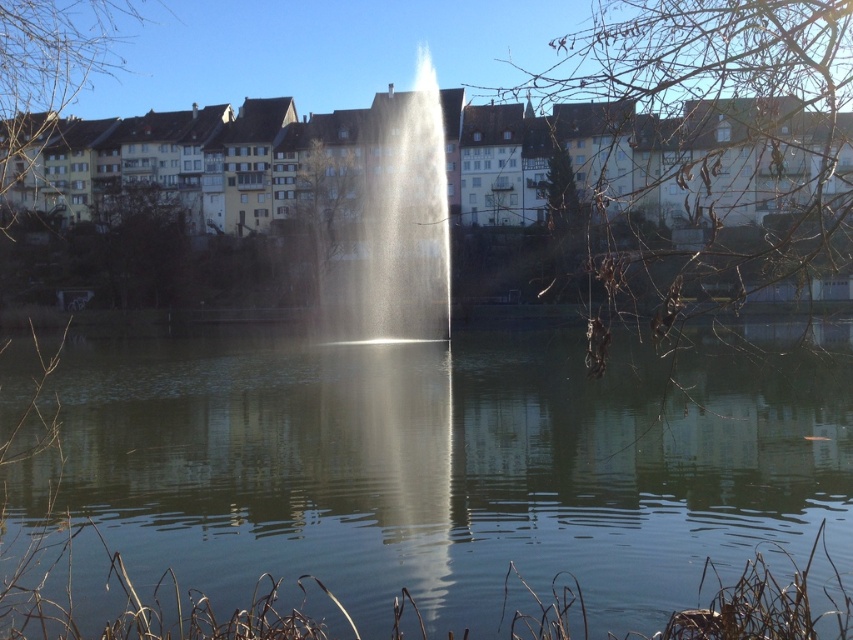
Which is in front, point (546, 477) or point (399, 144)?

Point (546, 477)

The image size is (853, 640). Describe the element at coordinates (451, 467) in the screenshot. I see `clear water at center` at that location.

Who is more forward, (426,440) or (409,268)?

Point (426,440)

You are a GUI agent. You are given a task and a screenshot of the screen. Output one action in this format:
    pyautogui.click(x=<x>, y=<y>)
    Task: Click on the clear water at center
    The width and height of the screenshot is (853, 640).
    Given the screenshot: What is the action you would take?
    pyautogui.click(x=451, y=467)